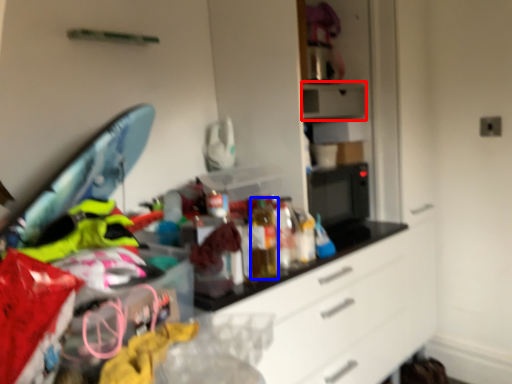
Question: Which point is further to the camera, appliance (highlighted by a red box) or bottle (highlighted by a blue box)?

Choices:
 (A) appliance
 (B) bottle

Answer: (A)